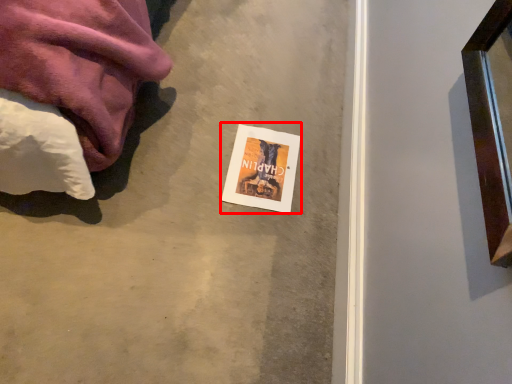
Question: From the image's perspective, considering the relative positions of flyer (annotated by the red box) and concrete in the image provided, where is flyer (annotated by the red box) located with respect to the staircase?

Choices:
 (A) above
 (B) below

Answer: (B)